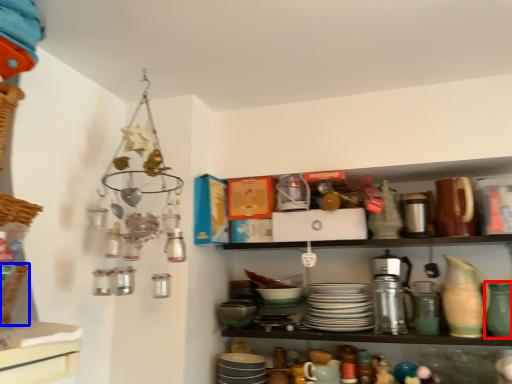
Question: Among these objects, which one is nearest to the camera, tableware (highlighted by a red box) or basket (highlighted by a blue box)?

Choices:
 (A) tableware
 (B) basket

Answer: (B)